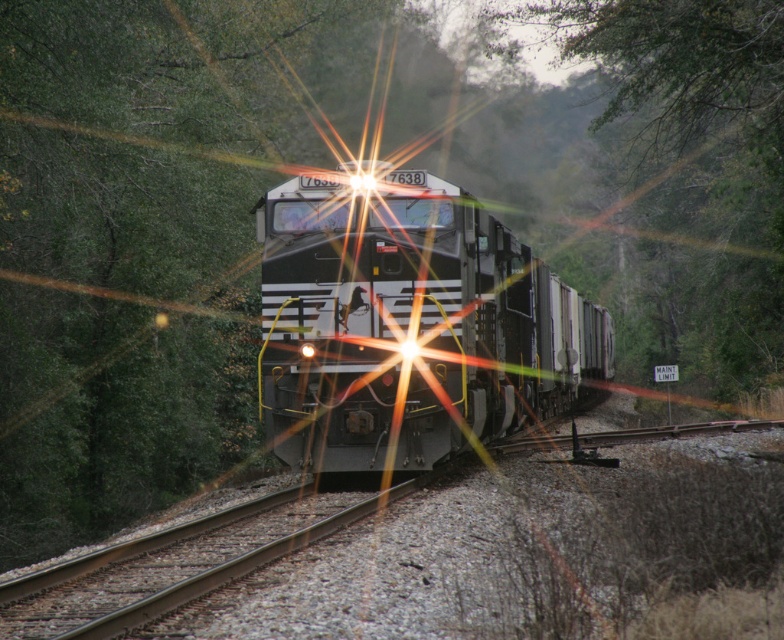
Does metallic freight train at center have a larger size compared to green leafy tree at center?

No.

Measure the distance between point (470, 308) and camera.

They are 54.55 feet apart.

Is point (487, 253) farther from viewer compared to point (679, 97)?

No, it is not.

Locate an element on the screen. The height and width of the screenshot is (640, 784). metallic freight train at center is located at coordinates (409, 323).